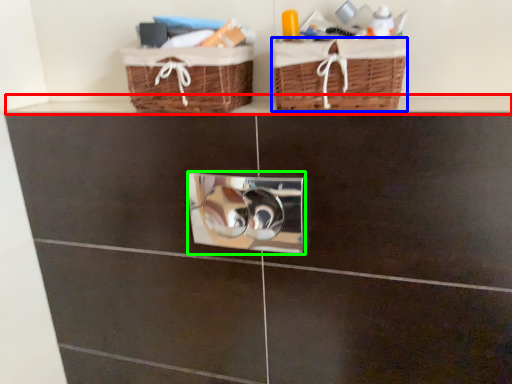
Question: Estimate the real-world distances between objects in this image. Which object is farther from ledge (highlighted by a red box), basket (highlighted by a blue box) or lock (highlighted by a green box)?

Choices:
 (A) basket
 (B) lock

Answer: (A)